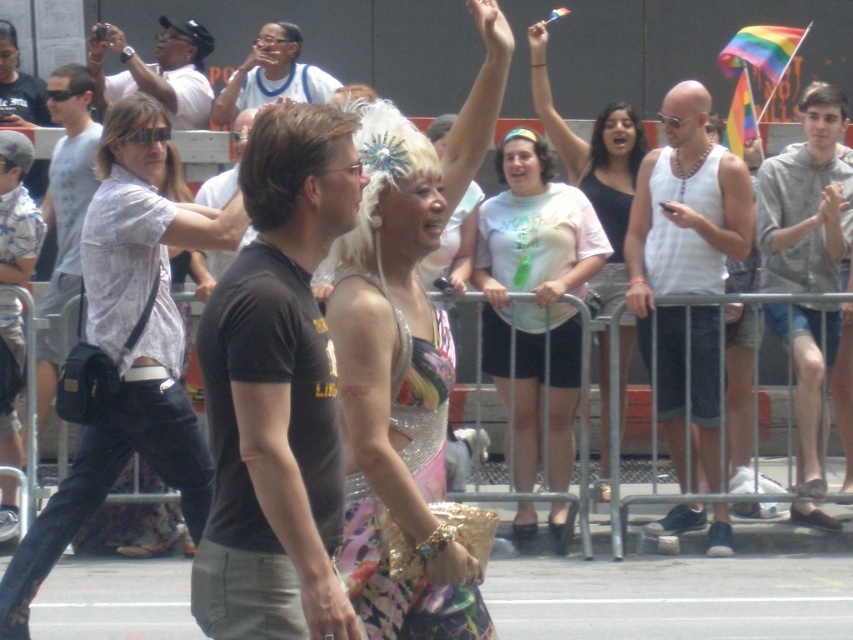
Who is positioned more to the right, gray hoodie at upper right or matte white shirt at center?

gray hoodie at upper right

This screenshot has width=853, height=640. Describe the element at coordinates (805, 202) in the screenshot. I see `gray hoodie at upper right` at that location.

Locate an element on the screen. The width and height of the screenshot is (853, 640). gray hoodie at upper right is located at coordinates (805, 202).

Is matte white shirt at left below brown cotton shirt at center?

Actually, matte white shirt at left is above brown cotton shirt at center.

Can you confirm if matte white shirt at left is positioned to the right of brown cotton shirt at center?

In fact, matte white shirt at left is to the left of brown cotton shirt at center.

Between point (76, 72) and point (242, 124), which one is positioned in front?

Positioned in front is point (242, 124).

Find the location of `matte white shirt at left`. matte white shirt at left is located at coordinates (68, 177).

Does black t-shirt at center have a greater width compared to matte white shirt at left?

Incorrect, black t-shirt at center's width does not surpass matte white shirt at left's.

Is point (221, 616) positioned behind point (67, 244)?

No, (221, 616) is in front of (67, 244).

Identify the location of black t-shirt at center. Image resolution: width=853 pixels, height=640 pixels. (277, 392).